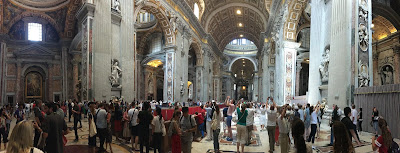
Where is `pillars`? pillars is located at coordinates (124, 56), (172, 67), (205, 80), (283, 73), (269, 77), (345, 51).